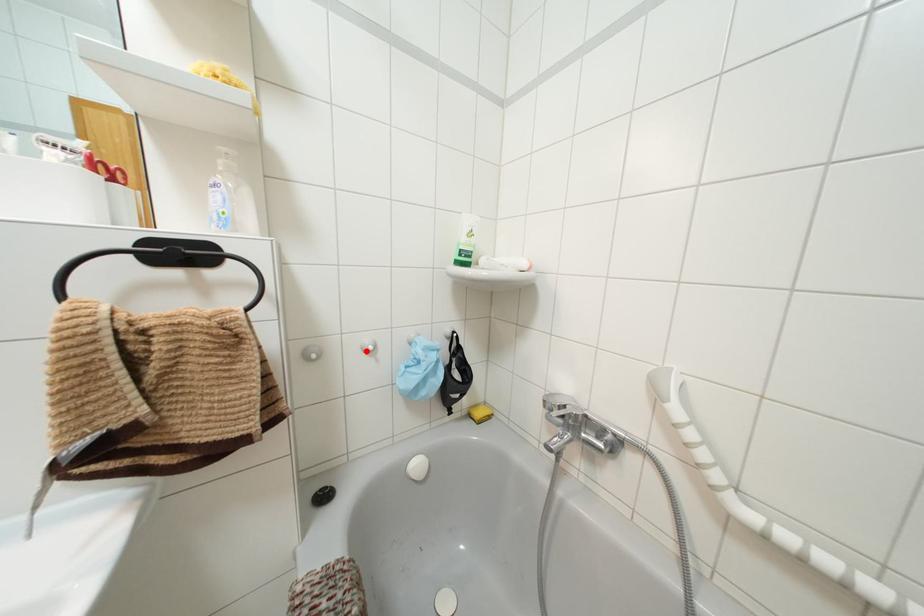
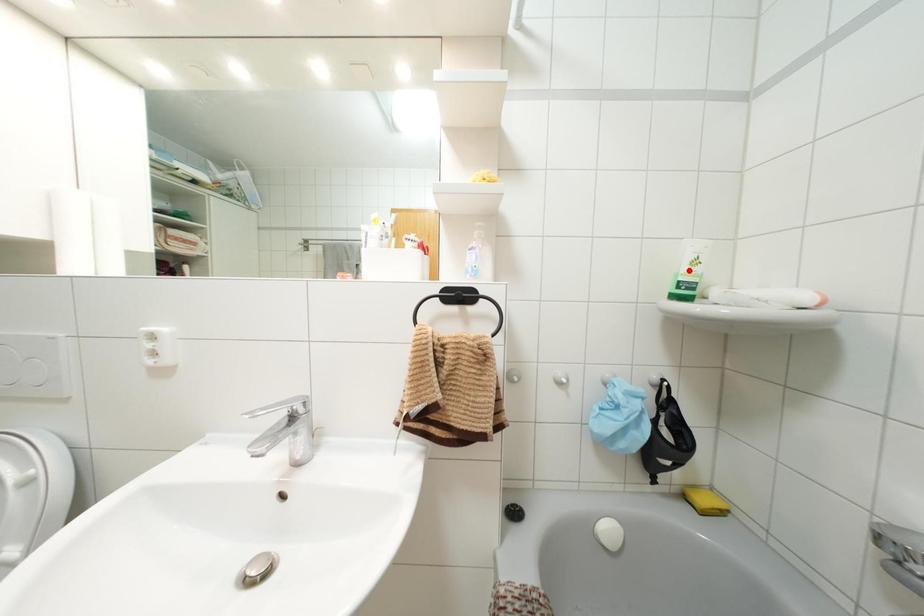
I am providing you with two images of the same scene from different viewpoints. A red point is marked on the first image and another point is marked on the second image. Do the highlighted points in image1 and image2 indicate the same real-world spot?

No